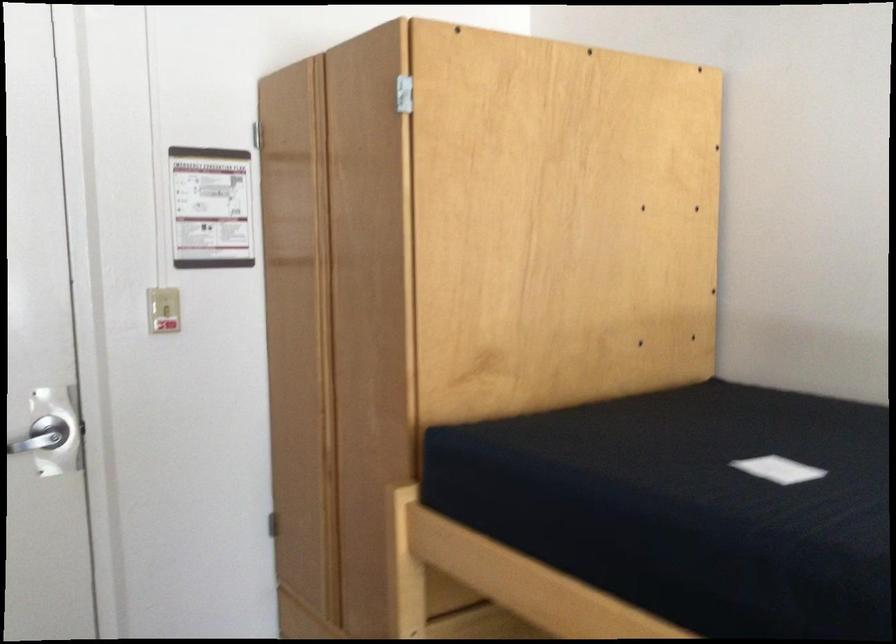
The width and height of the screenshot is (896, 644). I want to click on silver door handle, so click(x=47, y=440).